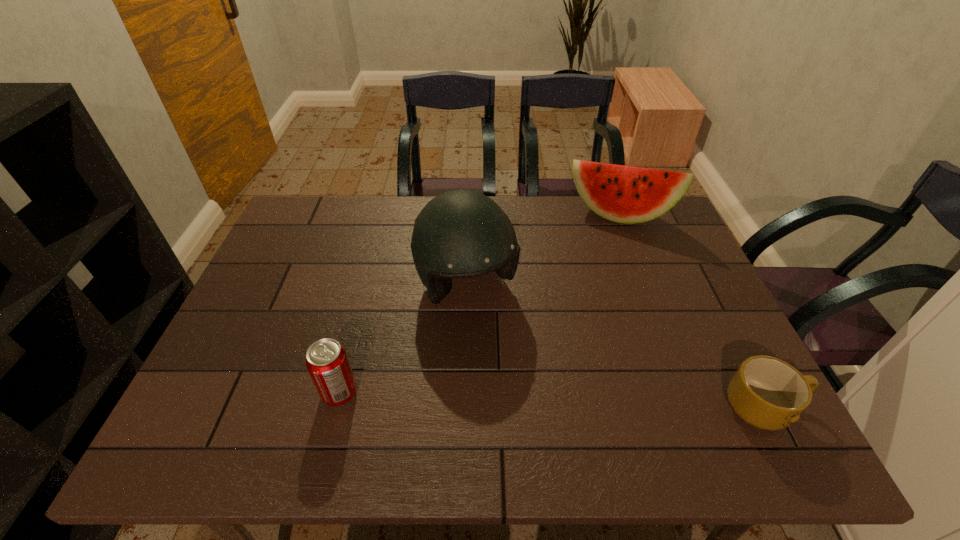
The height and width of the screenshot is (540, 960). What are the coordinates of `vacant point located between the farthest object and the leftmost object` in the screenshot? It's located at (480, 304).

Where is `free point between the soda and the second tallest object`? This screenshot has height=540, width=960. free point between the soda and the second tallest object is located at coordinates click(480, 304).

Where is `vacant region between the mug and the football helmet`? vacant region between the mug and the football helmet is located at coordinates (616, 347).

In order to click on vacant space that is in between the soda and the second tallest object in this screenshot , I will do `click(480, 304)`.

The height and width of the screenshot is (540, 960). I want to click on object that ranks as the third closest to the third shortest object, so click(x=326, y=360).

Identify the location of object that is the nearest to the farthest object. (459, 234).

Where is `vacant point that satisfies the following two spatial constraints: 1. on the front side of the shortest object; 2. on the side with the handle of the leftmost object`? This screenshot has width=960, height=540. vacant point that satisfies the following two spatial constraints: 1. on the front side of the shortest object; 2. on the side with the handle of the leftmost object is located at coordinates (336, 408).

This screenshot has height=540, width=960. I want to click on vacant space that satisfies the following two spatial constraints: 1. on the back side of the second shortest object; 2. on the left side of the tallest object, so click(x=368, y=286).

Where is `free location that satisfies the following two spatial constraints: 1. on the back side of the second object from left to right; 2. on the left side of the farthest object`? free location that satisfies the following two spatial constraints: 1. on the back side of the second object from left to right; 2. on the left side of the farthest object is located at coordinates (468, 215).

You are a GUI agent. You are given a task and a screenshot of the screen. Output one action in this format:
    pyautogui.click(x=<x>, y=<y>)
    Task: Click on the vacant space that satisfies the following two spatial constraints: 1. on the front side of the shortest object; 2. on the side with the handle of the soda
    This screenshot has height=540, width=960.
    Given the screenshot: What is the action you would take?
    pyautogui.click(x=336, y=408)